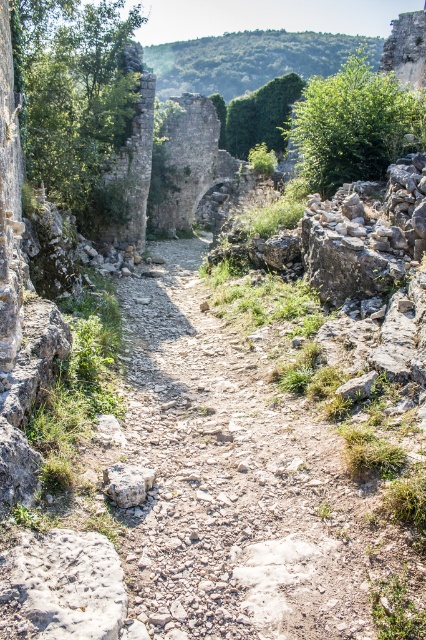
Question: Is gray rough stone at lower left smaller than gray rough stone at center?

Choices:
 (A) no
 (B) yes

Answer: (A)

Question: Which point is closer to the camera?

Choices:
 (A) (154, 472)
 (B) (17, 600)

Answer: (B)

Question: Among these objects, which one is farthest from the camera?

Choices:
 (A) gray rough stone at center
 (B) gray rough stone at lower left

Answer: (A)

Question: Is gray rough stone at lower left positioned at the back of gray rough stone at center?

Choices:
 (A) no
 (B) yes

Answer: (A)

Question: Does gray rough stone at lower left lie in front of gray rough stone at center?

Choices:
 (A) no
 (B) yes

Answer: (B)